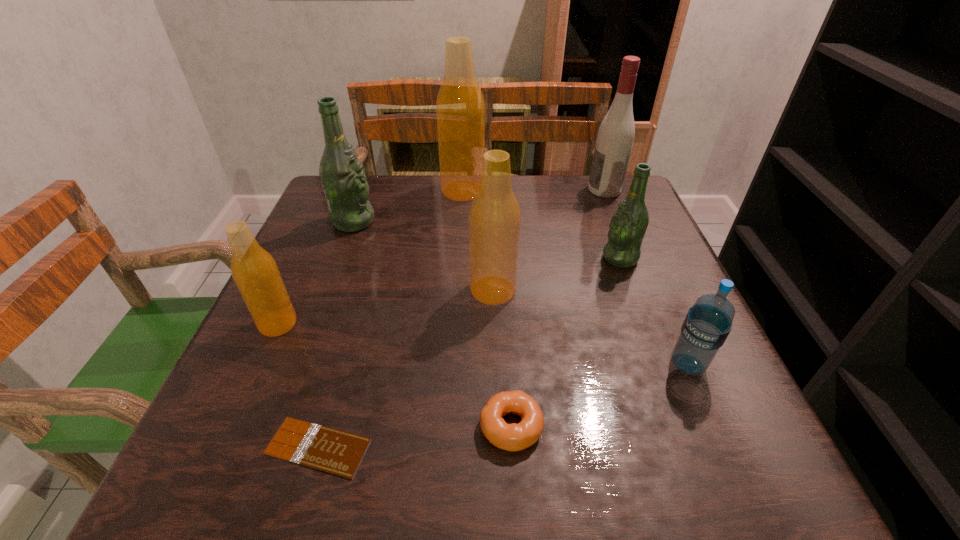
At what (x,y) coordinates should I click in order to perform the action: click on free spot between the alcohol and the doughnut. Please return your answer as a coordinate pair (x, y). This screenshot has width=960, height=540. Looking at the image, I should click on (558, 308).

Identify the location of free space between the alcohol and the chocolate bar. This screenshot has height=540, width=960. (461, 318).

Where is `free space between the doughnut and the blue water bottle`? Image resolution: width=960 pixels, height=540 pixels. free space between the doughnut and the blue water bottle is located at coordinates (599, 395).

Where is `object that can be found as the fourth closest to the second smallest tan beer bottle`? object that can be found as the fourth closest to the second smallest tan beer bottle is located at coordinates (342, 175).

Identify which object is the eighth nearest to the tan doughnut. Please provide its 2D coordinates. Your answer should be formatted as a tuple, i.e. [(x, y)], where the tuple contains the x and y coordinates of a point satisfying the conditions above.

[(615, 137)]

Identify which beer bottle is located as the nearest to the fourth nearest object. Please provide its 2D coordinates. Your answer should be formatted as a tuple, i.e. [(x, y)], where the tuple contains the x and y coordinates of a point satisfying the conditions above.

[(342, 175)]

Choose which beer bottle is the fourth nearest neighbor to the doughnut. Please provide its 2D coordinates. Your answer should be formatted as a tuple, i.e. [(x, y)], where the tuple contains the x and y coordinates of a point satisfying the conditions above.

[(342, 175)]

Where is `tan beer bottle that is the closest one to the shortest object`? The width and height of the screenshot is (960, 540). tan beer bottle that is the closest one to the shortest object is located at coordinates (255, 272).

Identify which tan beer bottle is located as the third nearest to the smaller green beer bottle. Please provide its 2D coordinates. Your answer should be formatted as a tuple, i.e. [(x, y)], where the tuple contains the x and y coordinates of a point satisfying the conditions above.

[(255, 272)]

This screenshot has height=540, width=960. Identify the location of vacant space that satisfies the following two spatial constraints: 1. on the back side of the tan doughnut; 2. on the surface of the farther green beer bottle. (499, 221).